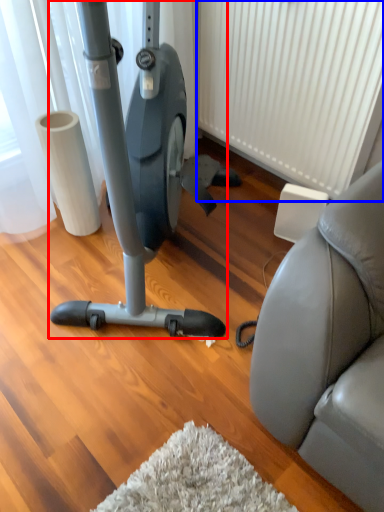
Question: Among these objects, which one is nearest to the camera, stationary bicycle (highlighted by a red box) or radiator (highlighted by a blue box)?

Choices:
 (A) stationary bicycle
 (B) radiator

Answer: (A)